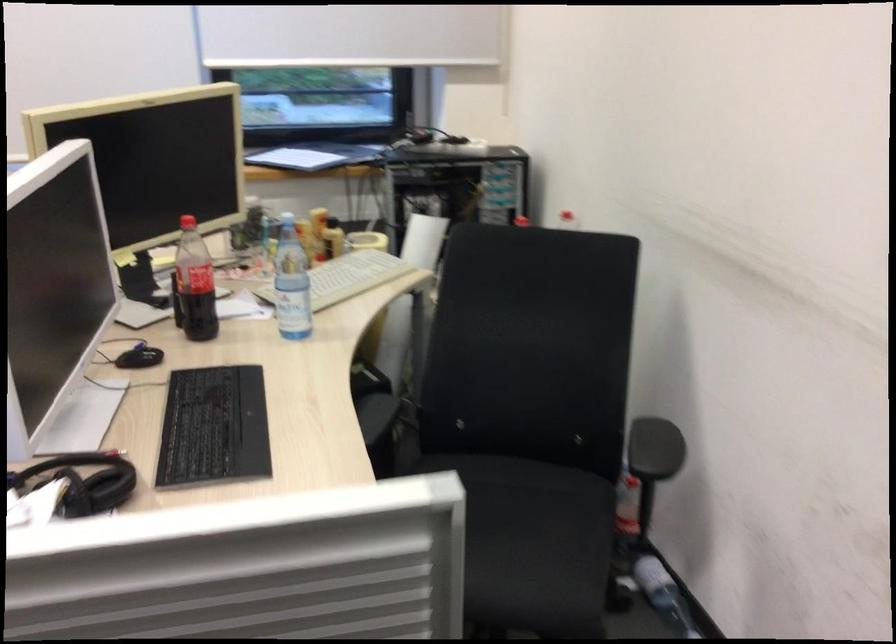
The location [140,357] corresponds to which object?

It refers to a black computer mouse.